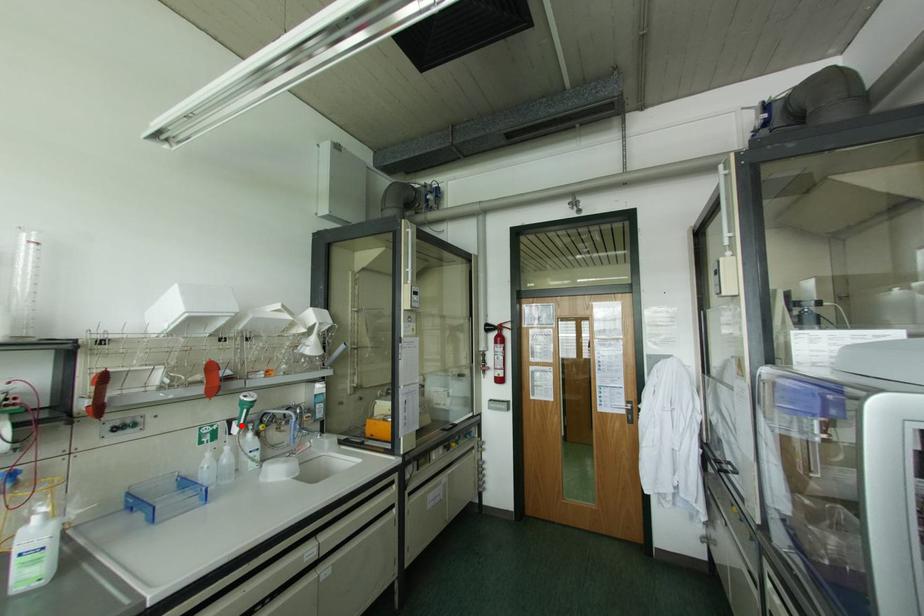
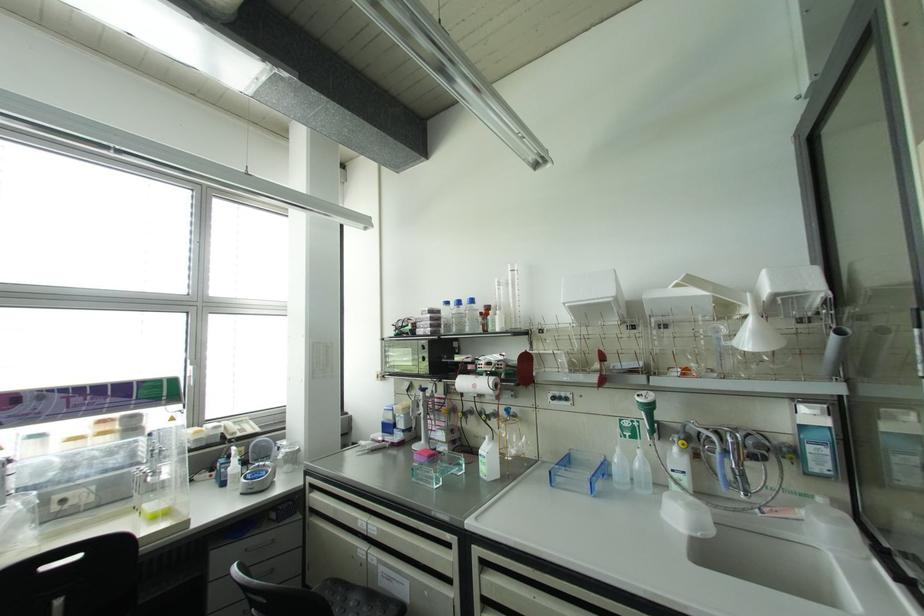
Find the pixel in the second image that matches the highlighted location in the first image.

(650, 432)